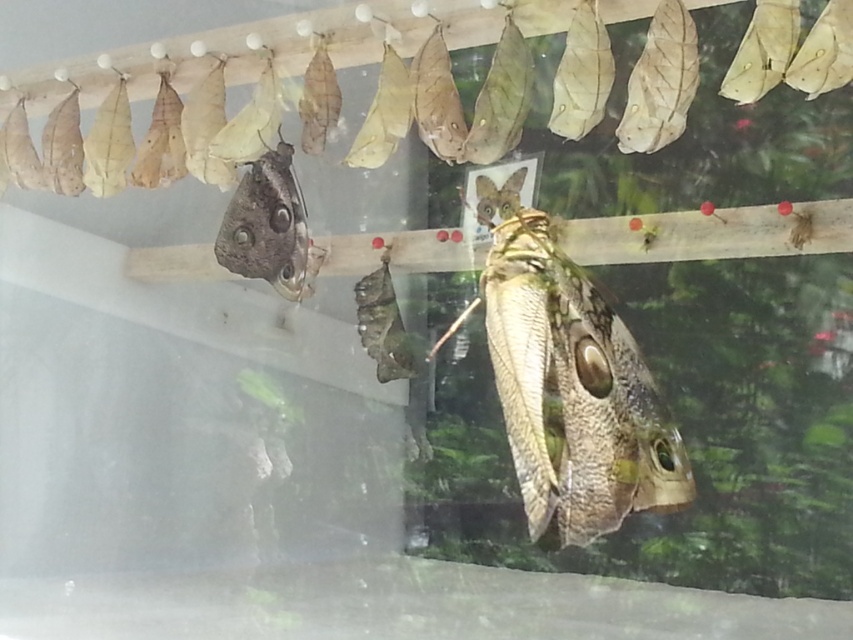
Question: Is brown textured butterfly at center in front of matte brown butterfly at upper left?

Choices:
 (A) no
 (B) yes

Answer: (B)

Question: Which point appears farthest from the camera in this image?

Choices:
 (A) (289, 163)
 (B) (575, 524)

Answer: (A)

Question: Observing the image, what is the correct spatial positioning of brown textured butterfly at center in reference to matte brown butterfly at upper left?

Choices:
 (A) below
 (B) above

Answer: (A)

Question: Is brown textured butterfly at center below matte brown butterfly at upper left?

Choices:
 (A) no
 (B) yes

Answer: (B)